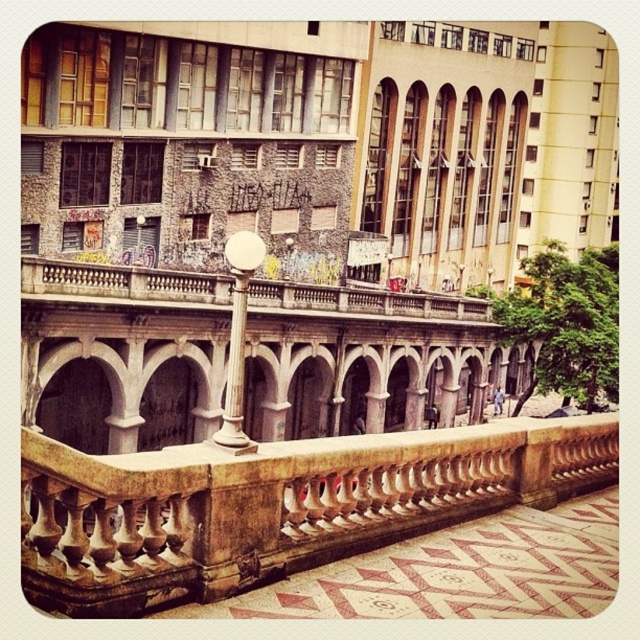
Which is more to the right, stone balustrade at center or white marble lamp post at center?

stone balustrade at center is more to the right.

Between point (32, 444) and point (221, 432), which one is positioned in front?

Point (32, 444)

Image resolution: width=640 pixels, height=640 pixels. Identify the location of stone balustrade at center. (275, 506).